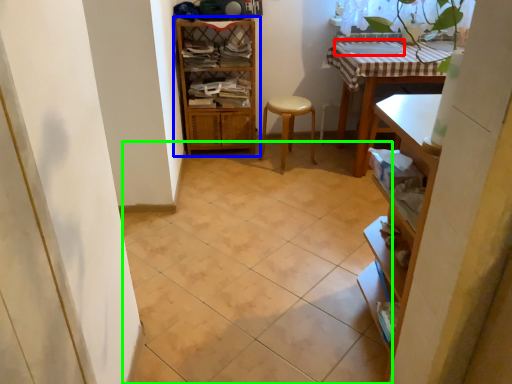
Question: Based on their relative distances, which object is farther from sink (highlighted by a red box)? Choose from shelf (highlighted by a blue box) and ceramic tile (highlighted by a green box).

Choices:
 (A) shelf
 (B) ceramic tile

Answer: (B)